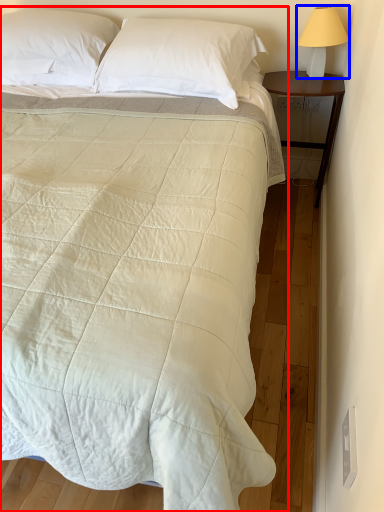
Question: Which object is closer to the camera taking this photo, bed (highlighted by a red box) or bedside lamp (highlighted by a blue box)?

Choices:
 (A) bed
 (B) bedside lamp

Answer: (A)